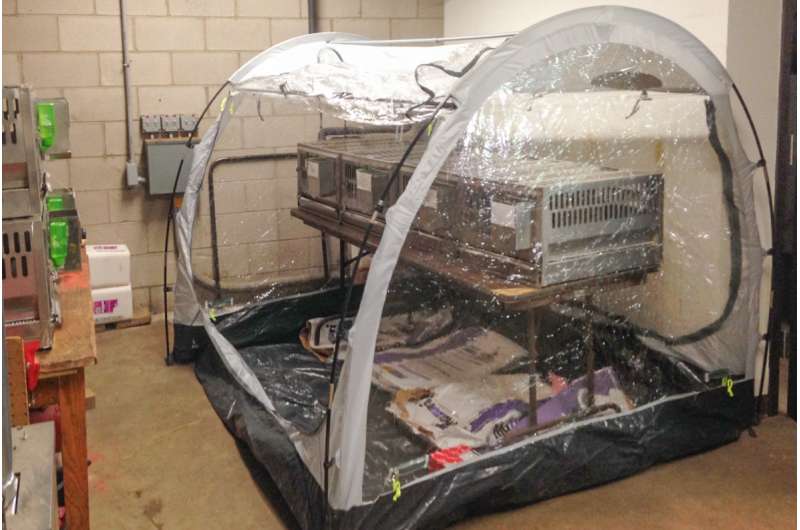
In order to click on bed in this screenshot , I will do `click(438, 350)`.